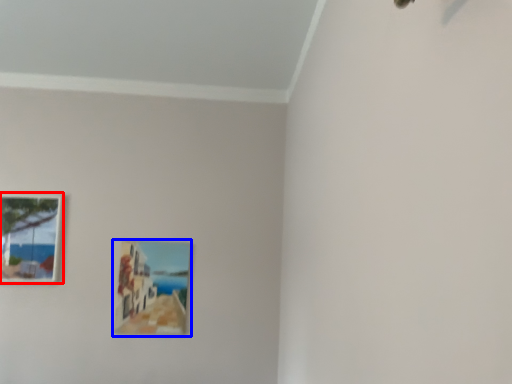
Question: Which object appears closest to the camera in this image, picture frame (highlighted by a red box) or picture frame (highlighted by a blue box)?

Choices:
 (A) picture frame
 (B) picture frame

Answer: (A)